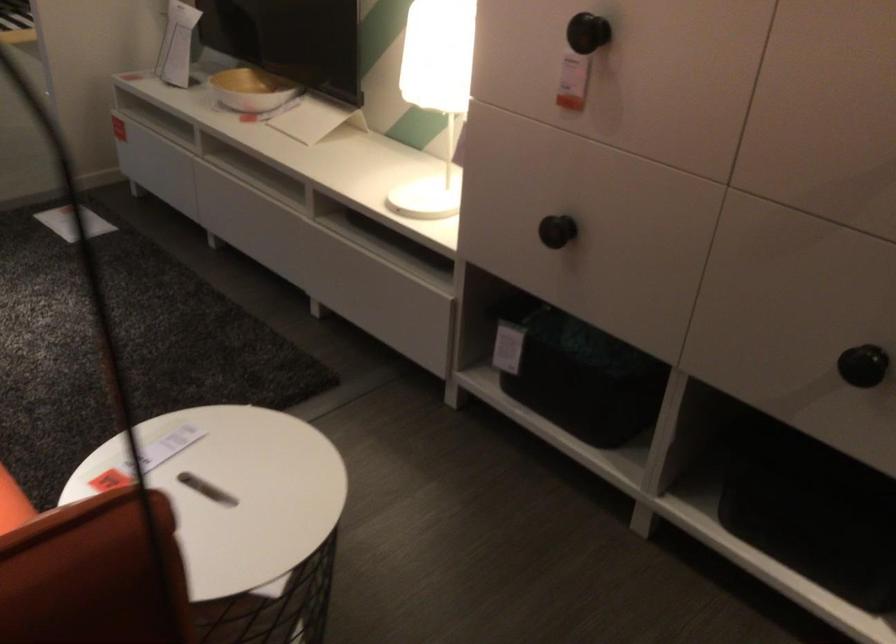
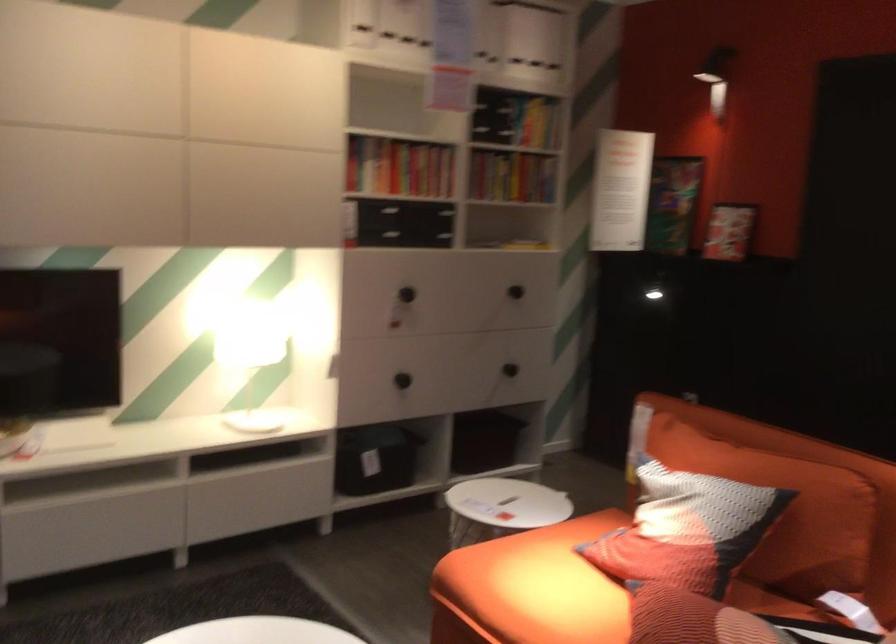
Where in the second image is the point corresponding to (435,93) from the first image?

(289, 350)